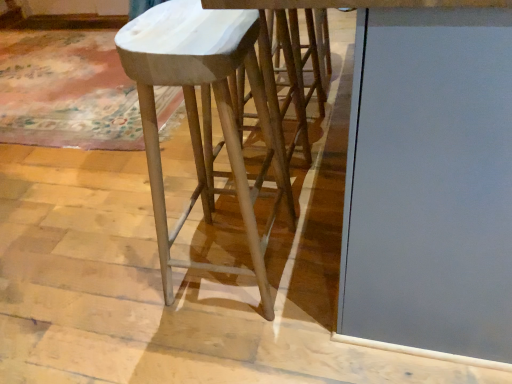
Question: In the image, is matte gray glass door at center on the left side or the right side of white marble stool at center?

Choices:
 (A) right
 (B) left

Answer: (A)

Question: From the image's perspective, is matte gray glass door at center above or below white marble stool at center?

Choices:
 (A) below
 (B) above

Answer: (B)

Question: Considering the positions of point (360, 102) and point (155, 38), is point (360, 102) closer or farther from the camera than point (155, 38)?

Choices:
 (A) closer
 (B) farther

Answer: (A)

Question: From a real-world perspective, relative to matte gray glass door at center, is white marble stool at center vertically above or below?

Choices:
 (A) above
 (B) below

Answer: (B)

Question: From the image's perspective, relative to matte gray glass door at center, is white marble stool at center above or below?

Choices:
 (A) below
 (B) above

Answer: (A)

Question: Relative to matte gray glass door at center, is white marble stool at center in front or behind?

Choices:
 (A) behind
 (B) front

Answer: (A)

Question: Visually, is white marble stool at center positioned to the left or to the right of matte gray glass door at center?

Choices:
 (A) right
 (B) left

Answer: (B)